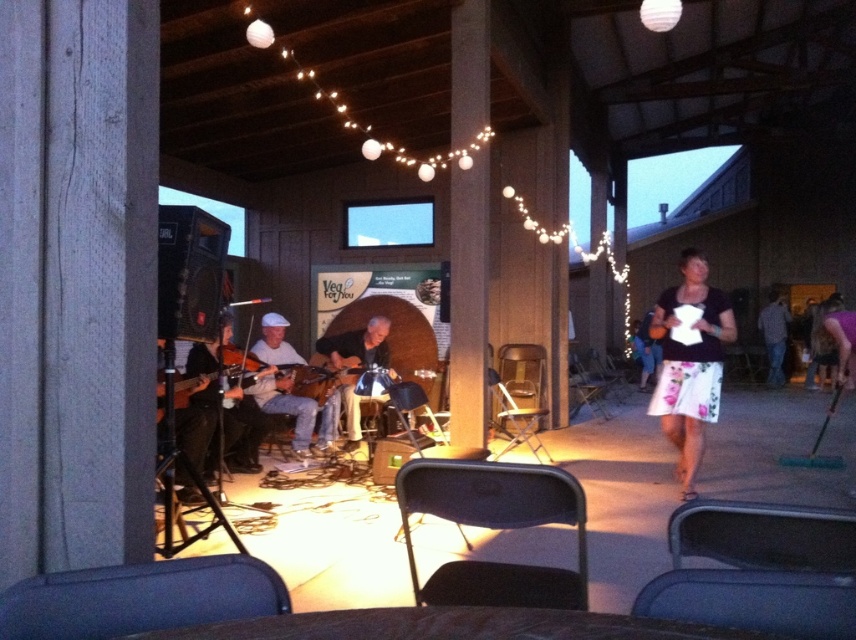
Based on the photo, you are organizing a small outdoor concert at the pavilion and need to place both the matte brown guitar at center and the wooden acoustic guitar at center on a table that can hold items up to 1.2 meters in length. Which guitar should you choose to ensure it fits on the table?

The wooden acoustic guitar at center is smaller in size compared to the matte brown guitar at center, so the wooden acoustic guitar at center is more likely to fit on the table within the 1.2 meters length limit.

You are a photographer at the event and want to capture a photo of both the floral skirt at right and the matte brown guitar at center. Since you can only focus on one object at a time, which one should you focus on to ensure the other is still in the background?

You should focus on the floral skirt at right because it is in front of the matte brown guitar at center, so the guitar will naturally appear in the background.